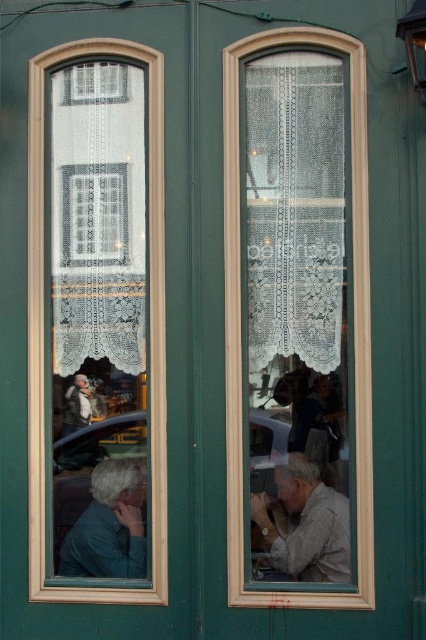
Can you confirm if clear glass window at left is shorter than light brown leather jacket at left?

Incorrect, clear glass window at left's height does not fall short of light brown leather jacket at left's.

From the picture: Is clear glass window at left bigger than light brown leather jacket at left?

Indeed, clear glass window at left has a larger size compared to light brown leather jacket at left.

This screenshot has width=426, height=640. Describe the element at coordinates (43, 328) in the screenshot. I see `clear glass window at left` at that location.

Identify the location of clear glass window at left. [43, 328].

Is white lace curtain at center closer to camera compared to light brown fabric shirt at center?

Yes, it is.

You are a GUI agent. You are given a task and a screenshot of the screen. Output one action in this format:
    pyautogui.click(x=<x>, y=<y>)
    Task: Click on the white lace curtain at center
    Image resolution: width=426 pixels, height=640 pixels.
    Given the screenshot: What is the action you would take?
    pyautogui.click(x=354, y=323)

I want to click on white lace curtain at center, so click(x=354, y=323).

Is dark blue fabric jacket at lower left smaller than light brown leather jacket at left?

Incorrect, dark blue fabric jacket at lower left is not smaller in size than light brown leather jacket at left.

Who is more forward, (114, 548) or (68, 403)?

Point (114, 548) is more forward.

Where is `dark blue fabric jacket at lower left`? dark blue fabric jacket at lower left is located at coordinates point(109,524).